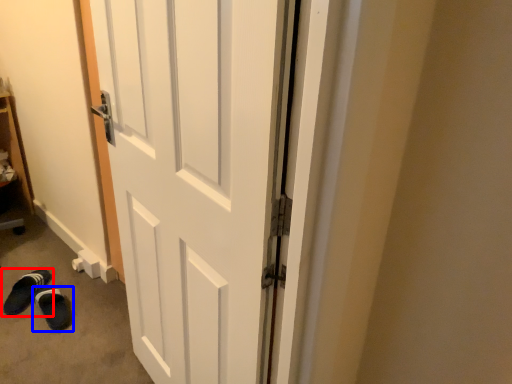
Question: Which object is further to the camera taking this photo, footwear (highlighted by a red box) or footwear (highlighted by a blue box)?

Choices:
 (A) footwear
 (B) footwear

Answer: (A)